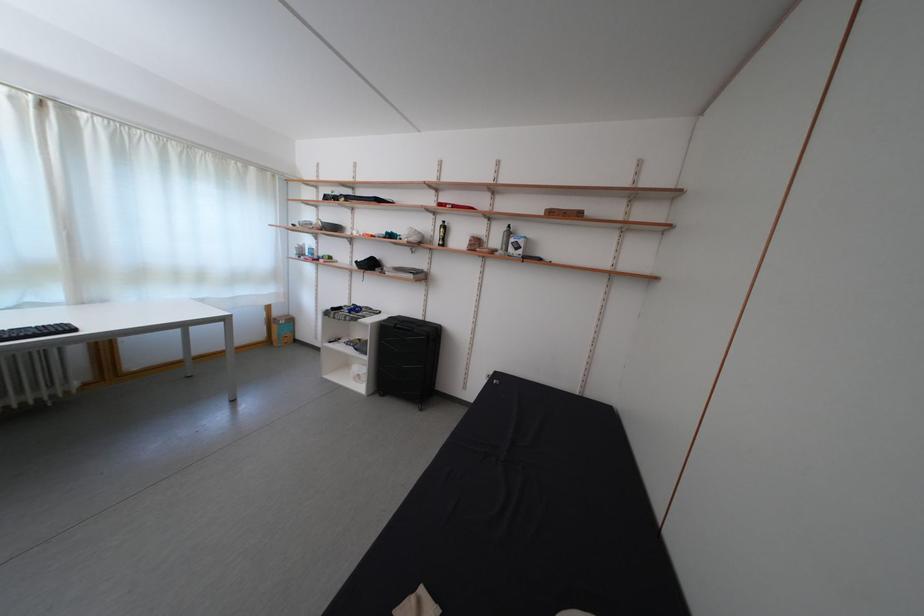
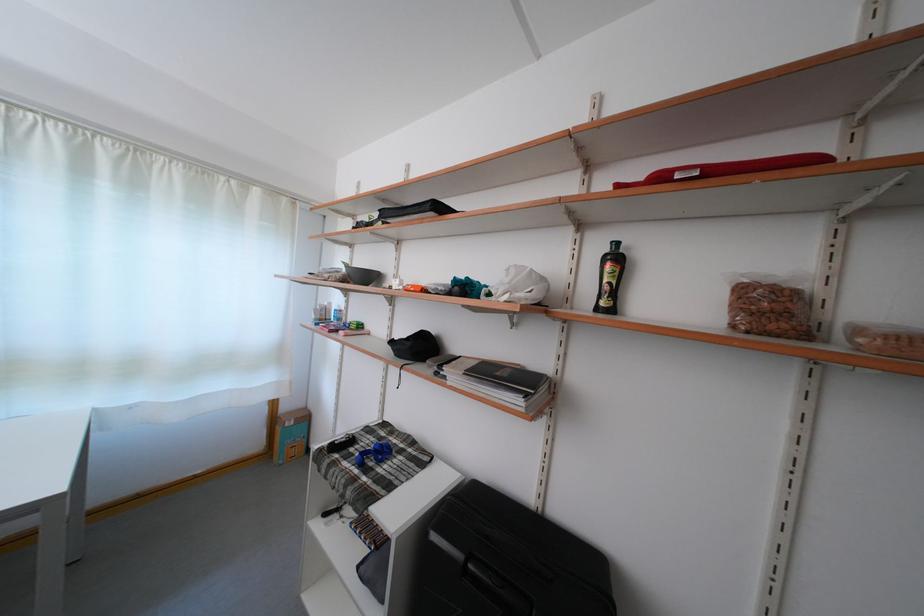
Find the pixel in the second image that matches pixel 285 320 in the first image.

(293, 415)